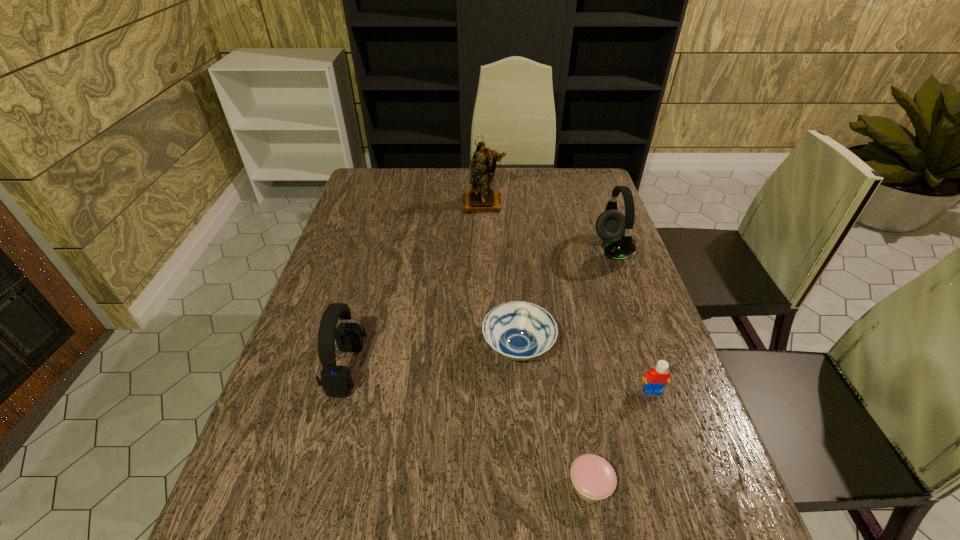
Find the location of `free location located on the front-facing side of the farthest object`. free location located on the front-facing side of the farthest object is located at coordinates (484, 232).

Where is `vacant region located on the ear cups of the right headset`? This screenshot has height=540, width=960. vacant region located on the ear cups of the right headset is located at coordinates (492, 248).

Where is `vacant space situated on the ear cups of the right headset`? vacant space situated on the ear cups of the right headset is located at coordinates (569, 248).

The height and width of the screenshot is (540, 960). Identify the location of free space located on the ear cups of the right headset. (465, 248).

The width and height of the screenshot is (960, 540). I want to click on vacant area situated 0.160m on the headband of the nearer headset, so click(x=435, y=369).

Where is `vacant space located 0.230m on the face of the fourth tallest object`? Image resolution: width=960 pixels, height=540 pixels. vacant space located 0.230m on the face of the fourth tallest object is located at coordinates (692, 509).

Locate an element on the screen. free space located on the front of the second shortest object is located at coordinates (523, 412).

Locate an element on the screen. This screenshot has width=960, height=540. vacant space located on the back of the cupcake is located at coordinates tap(574, 399).

Where is `object present at the far edge`? object present at the far edge is located at coordinates (480, 198).

Find the location of a particular element. Image resolution: width=960 pixels, height=540 pixels. object at the left edge is located at coordinates (336, 381).